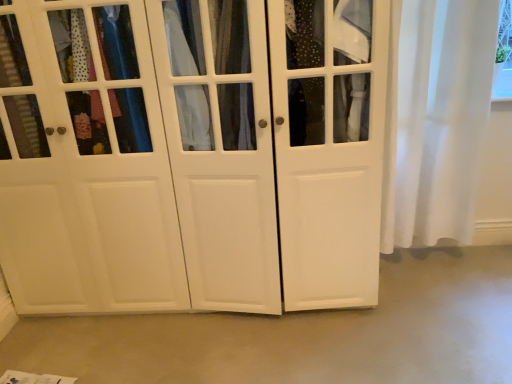
Question: Is smooth concrete floor at center closer to the viewer compared to white sheer curtain at right?

Choices:
 (A) yes
 (B) no

Answer: (A)

Question: Is smooth concrete floor at center smaller than white sheer curtain at right?

Choices:
 (A) no
 (B) yes

Answer: (B)

Question: Does smooth concrete floor at center turn towards white sheer curtain at right?

Choices:
 (A) no
 (B) yes

Answer: (A)

Question: Is smooth concrete floor at center looking in the opposite direction of white sheer curtain at right?

Choices:
 (A) yes
 (B) no

Answer: (B)

Question: Is smooth concrete floor at center thinner than white sheer curtain at right?

Choices:
 (A) no
 (B) yes

Answer: (A)

Question: Considering the positions of point (423, 321) and point (486, 26), is point (423, 321) closer or farther from the camera than point (486, 26)?

Choices:
 (A) closer
 (B) farther

Answer: (B)

Question: Considering the positions of smooth concrete floor at center and white sheer curtain at right in the image, is smooth concrete floor at center taller or shorter than white sheer curtain at right?

Choices:
 (A) tall
 (B) short

Answer: (B)

Question: From the image's perspective, is smooth concrete floor at center above or below white sheer curtain at right?

Choices:
 (A) above
 (B) below

Answer: (B)

Question: Would you say smooth concrete floor at center is to the left or to the right of white sheer curtain at right in the picture?

Choices:
 (A) right
 (B) left

Answer: (B)

Question: Is white matte cabinet at center situated inside white sheer curtain at right or outside?

Choices:
 (A) outside
 (B) inside

Answer: (A)

Question: From the image's perspective, is white matte cabinet at center positioned above or below white sheer curtain at right?

Choices:
 (A) below
 (B) above

Answer: (A)

Question: In terms of size, does white matte cabinet at center appear bigger or smaller than white sheer curtain at right?

Choices:
 (A) big
 (B) small

Answer: (A)

Question: Is white matte cabinet at center taller or shorter than white sheer curtain at right?

Choices:
 (A) tall
 (B) short

Answer: (A)

Question: From the image's perspective, is smooth concrete floor at center located above or below white matte cabinet at center?

Choices:
 (A) above
 (B) below

Answer: (B)

Question: Is smooth concrete floor at center to the left or to the right of white matte cabinet at center in the image?

Choices:
 (A) left
 (B) right

Answer: (B)